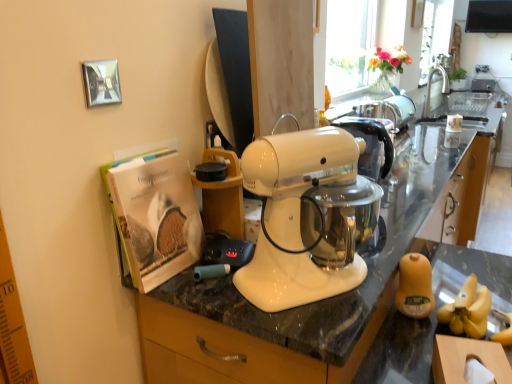
Question: Is point (438, 74) closer or farther from the camera than point (413, 281)?

Choices:
 (A) farther
 (B) closer

Answer: (A)

Question: From the image's perspective, is silver metallic faucet at upper right positioned above or below yellow matte jar at lower right?

Choices:
 (A) below
 (B) above

Answer: (B)

Question: Which object is positioned farthest from the matte paper magazine at left?

Choices:
 (A) silver metallic faucet at upper right
 (B) yellow matte jar at lower right
 (C) white glossy countertop at center

Answer: (A)

Question: Considering the real-world distances, which object is farthest from the matte paper magazine at left?

Choices:
 (A) yellow matte jar at lower right
 (B) silver metallic faucet at upper right
 (C) white glossy countertop at center

Answer: (B)